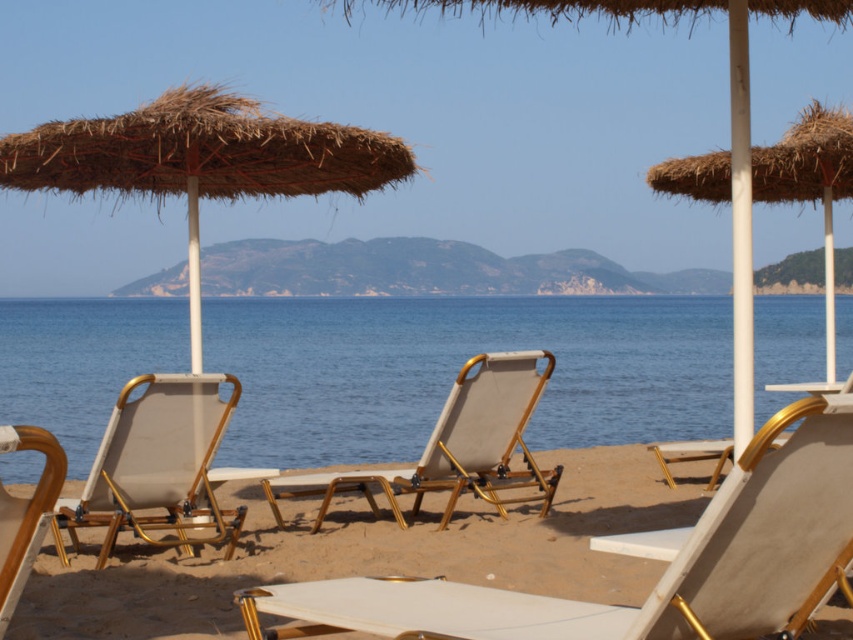
The width and height of the screenshot is (853, 640). I want to click on wooden textured beach chair at center, so click(x=660, y=576).

Is point (425, 602) closer to camera compared to point (22, 524)?

No, (425, 602) is behind (22, 524).

Does point (735, 536) lie in front of point (6, 428)?

No, (735, 536) is behind (6, 428).

Locate an element on the screen. Image resolution: width=853 pixels, height=640 pixels. wooden textured beach chair at center is located at coordinates (660, 576).

Is beige fabric beach chair at left further to the viewer compared to wooden lounge chair at lower left?

Yes, it is.

Which is above, beige fabric beach chair at left or wooden lounge chair at lower left?

wooden lounge chair at lower left is above.

Is point (231, 408) farther from viewer compared to point (38, 515)?

That is True.

Find the location of a particular element. beige fabric beach chair at left is located at coordinates (157, 465).

Is point (804, 520) in front of point (224, 125)?

Yes, point (804, 520) is in front of point (224, 125).

Is the position of wooden textured beach chair at center more distant than that of natural straw umbrella at left?

That is False.

Where is `wooden textured beach chair at center`? wooden textured beach chair at center is located at coordinates (660, 576).